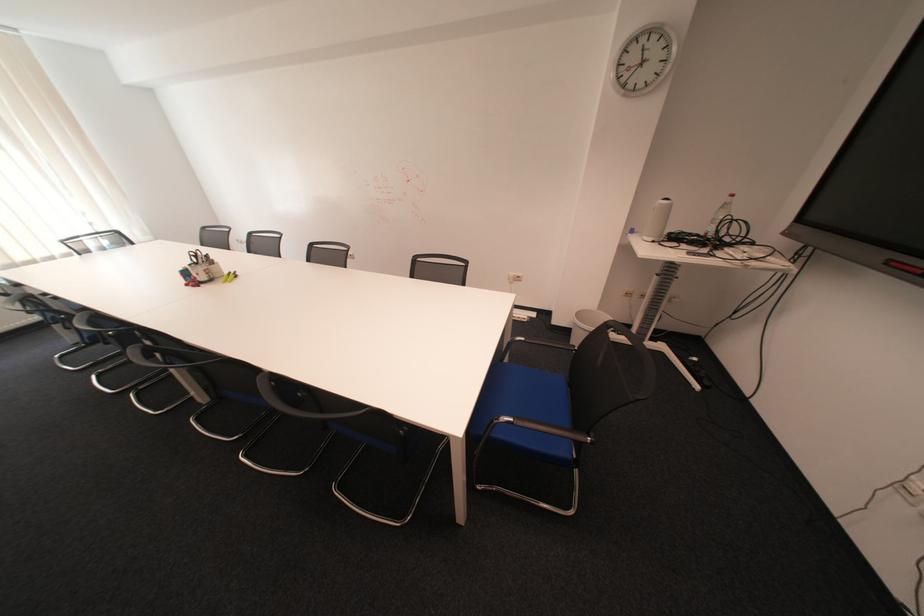
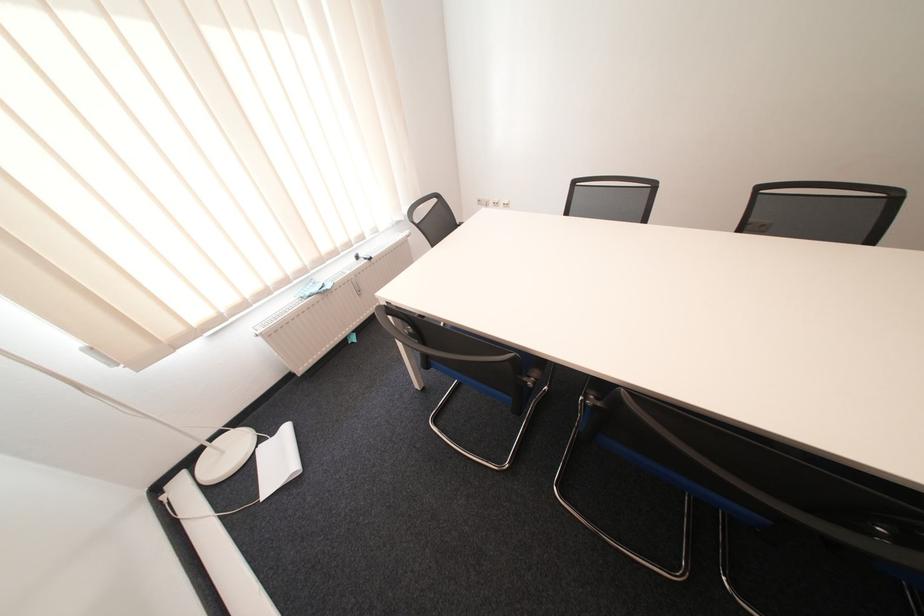
Question: In a continuous first-person perspective shot, in which direction is the camera moving?

Choices:
 (A) Left
 (B) Right
 (C) Forward
 (D) Backward

Answer: (A)